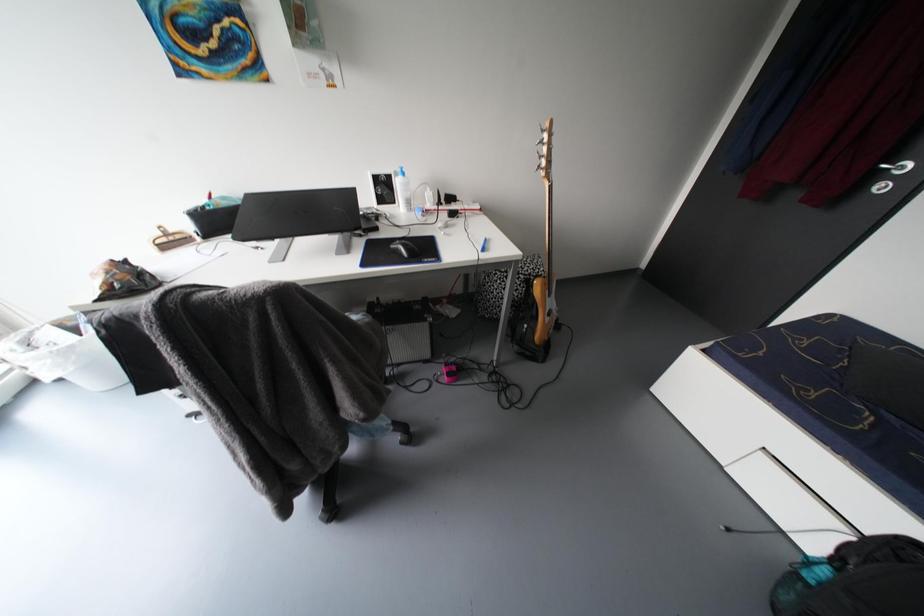
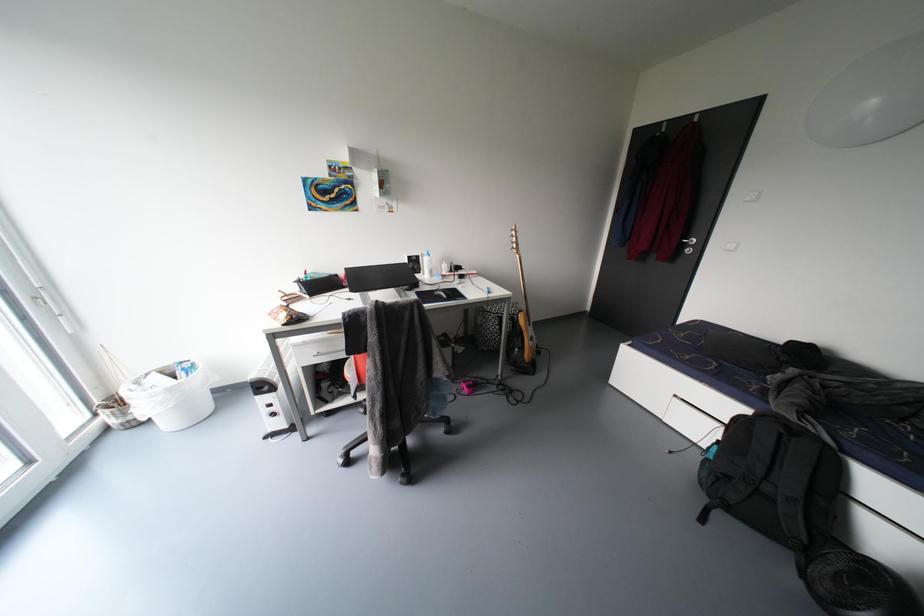
Question: The first image is from the beginning of the video and the second image is from the end. How did the camera likely rotate when shooting the video?

Choices:
 (A) Left
 (B) Right
 (C) Up
 (D) Down

Answer: (C)